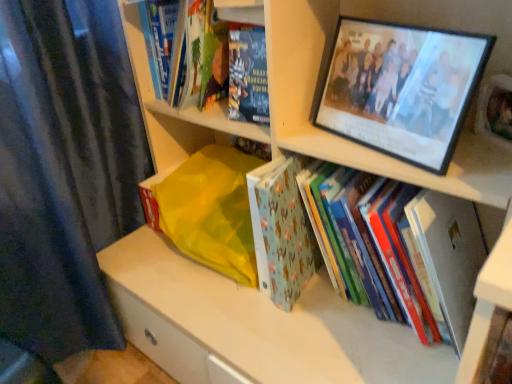
Question: Is the position of hardcover book at upper left, which ranks as the first book in left-to-right order, less distant than that of light blue fabric book at center, positioned as the 2th book in right-to-left order?

Choices:
 (A) yes
 (B) no

Answer: (B)

Question: Are hardcover book at upper left, positioned as the fifth book in right-to-left order, and light blue fabric book at center, acting as the fourth book starting from the left, far apart?

Choices:
 (A) no
 (B) yes

Answer: (A)

Question: Is hardcover book at upper left, which ranks as the first book in left-to-right order, behind light blue fabric book at center, acting as the fourth book starting from the left?

Choices:
 (A) no
 (B) yes

Answer: (B)

Question: Is hardcover book at upper left, which ranks as the first book in left-to-right order, thinner than light blue fabric book at center, positioned as the 2th book in right-to-left order?

Choices:
 (A) no
 (B) yes

Answer: (B)

Question: Can you confirm if hardcover book at upper left, which ranks as the first book in left-to-right order, is wider than light blue fabric book at center, acting as the fourth book starting from the left?

Choices:
 (A) no
 (B) yes

Answer: (A)

Question: In the image, is hardcover book at upper left, placed as the second book when sorted from left to right, positioned in front of or behind hardcover book at upper center, acting as the 3th book starting from the right?

Choices:
 (A) front
 (B) behind

Answer: (A)

Question: Considering the positions of point (224, 87) and point (265, 89), is point (224, 87) closer or farther from the camera than point (265, 89)?

Choices:
 (A) closer
 (B) farther

Answer: (B)

Question: From a real-world perspective, is hardcover book at upper left, placed as the second book when sorted from left to right, physically located above or below hardcover book at upper center, positioned as the third book in left-to-right order?

Choices:
 (A) below
 (B) above

Answer: (B)

Question: Is hardcover book at upper left, placed as the second book when sorted from left to right, to the left or to the right of hardcover book at upper center, positioned as the third book in left-to-right order, in the image?

Choices:
 (A) left
 (B) right

Answer: (A)

Question: Considering their positions, is hardcover book at lower right located in front of or behind light blue fabric book at center, acting as the fourth book starting from the left?

Choices:
 (A) behind
 (B) front

Answer: (B)

Question: Based on their positions, is hardcover book at lower right located to the left or right of light blue fabric book at center, acting as the fourth book starting from the left?

Choices:
 (A) left
 (B) right

Answer: (B)

Question: Looking at the image, does hardcover book at lower right seem bigger or smaller compared to light blue fabric book at center, positioned as the 2th book in right-to-left order?

Choices:
 (A) small
 (B) big

Answer: (A)

Question: Is point (464, 327) positioned closer to the camera than point (266, 288)?

Choices:
 (A) closer
 (B) farther

Answer: (A)

Question: From a real-world perspective, is hardcover book at center, the 1th book from the right, positioned above or below hardcover book at upper center, positioned as the third book in left-to-right order?

Choices:
 (A) below
 (B) above

Answer: (A)

Question: In the image, is hardcover book at center, the 1th book from the right, positioned in front of or behind hardcover book at upper center, positioned as the third book in left-to-right order?

Choices:
 (A) behind
 (B) front

Answer: (B)